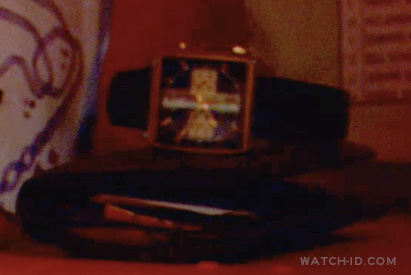
This screenshot has width=411, height=275. In order to click on wall in this screenshot , I will do `click(135, 36)`.